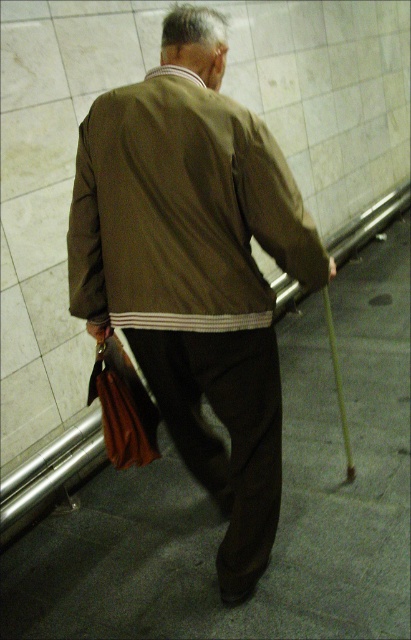
Looking at this image, you are a photographer trying to capture both the brown fabric jacket at center and the brown textured jacket at center in the same frame. Given that your camera has a minimum focus distance of 3 inches, can you adjust your position to ensure both jackets are in focus?

The distance between the brown fabric jacket at center and brown textured jacket at center is 3.37 inches, which is greater than the camera minimum focus distance of 3 inches. Therefore, you can adjust your position to ensure both jackets are in focus.

You are a fashion designer observing a man in an indoor setting. You notice two jackets on him labeled as brown fabric jacket at center and brown textured jacket at center. Which jacket is positioned lower on his body?

The brown fabric jacket at center is located below the brown textured jacket at center, so the brown fabric jacket at center is positioned lower on his body.

You are a fashion designer observing a man wearing two jackets in an indoor subway station. Which jacket, the brown fabric jacket at center or the brown textured jacket at center, is located to the right of the other?

The brown fabric jacket at center is positioned on the right side of the brown textured jacket at center.